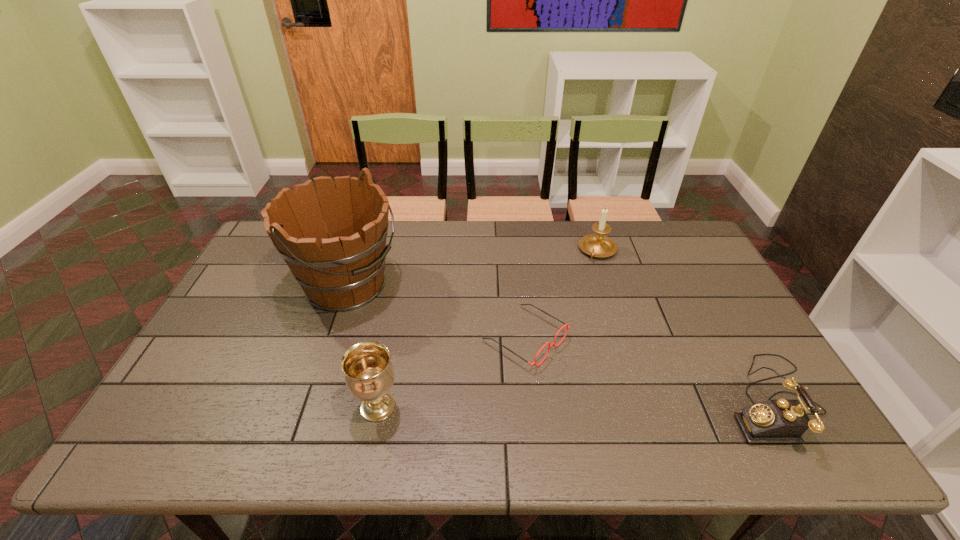
Locate which object is the fourth closest to the candle holder. Please provide its 2D coordinates. Your answer should be formatted as a tuple, i.e. [(x, y)], where the tuple contains the x and y coordinates of a point satisfying the conditions above.

[(369, 375)]

Locate which object ranks in proximity to the chalice. Please provide its 2D coordinates. Your answer should be formatted as a tuple, i.e. [(x, y)], where the tuple contains the x and y coordinates of a point satisfying the conditions above.

[(340, 269)]

Identify the location of free space in the image that satisfies the following two spatial constraints: 1. on the front side of the wine bucket; 2. on the dial of the rightmost object. The image size is (960, 540). point(307,401).

The height and width of the screenshot is (540, 960). I want to click on vacant area that satisfies the following two spatial constraints: 1. on the front side of the second shortest object; 2. on the dial of the wine bucket, so click(x=307, y=401).

Find the location of `vacant space that satisfies the following two spatial constraints: 1. on the front side of the telephone; 2. on the dial of the candle holder`. vacant space that satisfies the following two spatial constraints: 1. on the front side of the telephone; 2. on the dial of the candle holder is located at coordinates (647, 401).

Find the location of a particular element. The image size is (960, 540). vacant region that satisfies the following two spatial constraints: 1. on the back side of the chalice; 2. on the dial of the second shortest object is located at coordinates (379, 401).

What are the coordinates of `free space that satisfies the following two spatial constraints: 1. on the back side of the spectacles; 2. on the left side of the fourth object from left to right` in the screenshot? It's located at (516, 251).